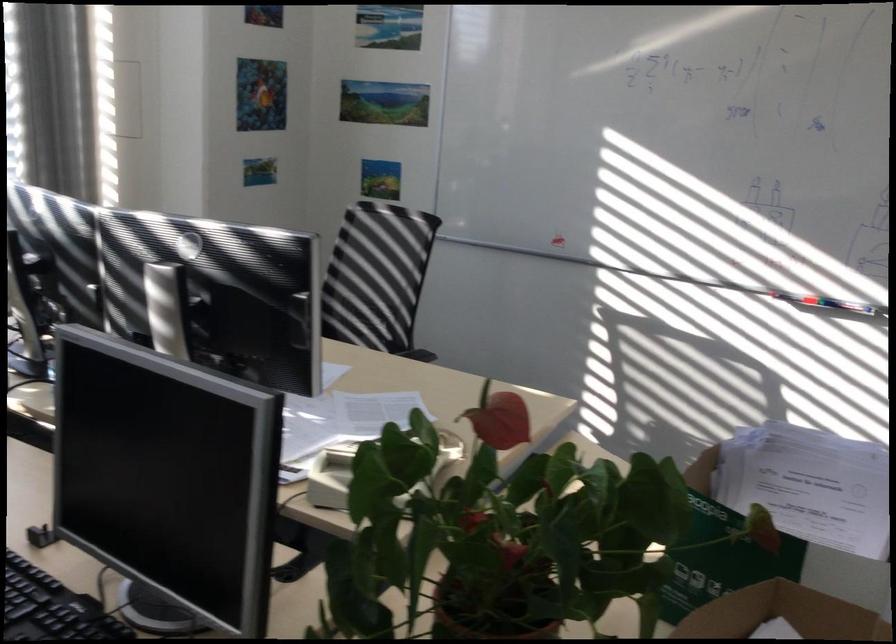
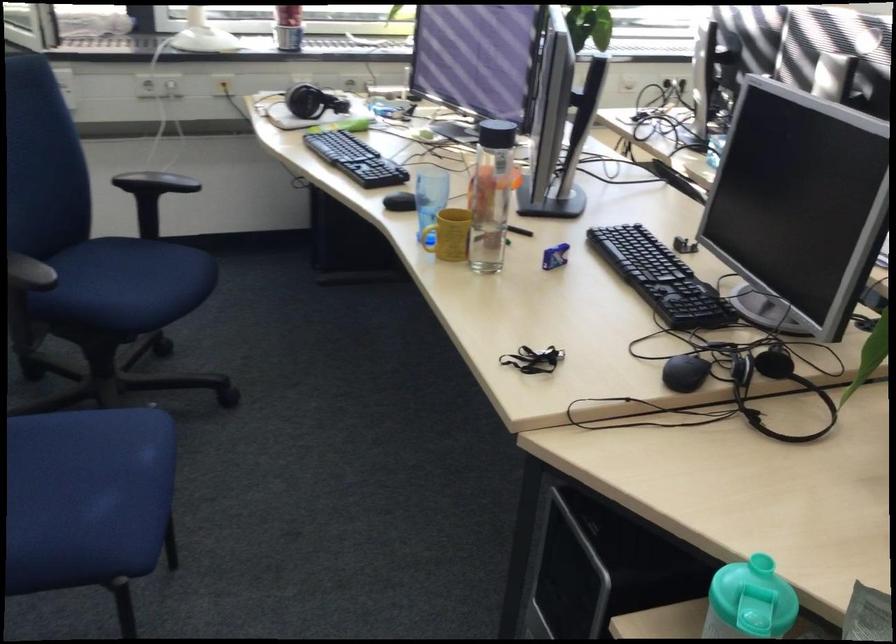
Question: How did the camera likely rotate?

Choices:
 (A) Left
 (B) Right
 (C) Up
 (D) Down

Answer: (A)